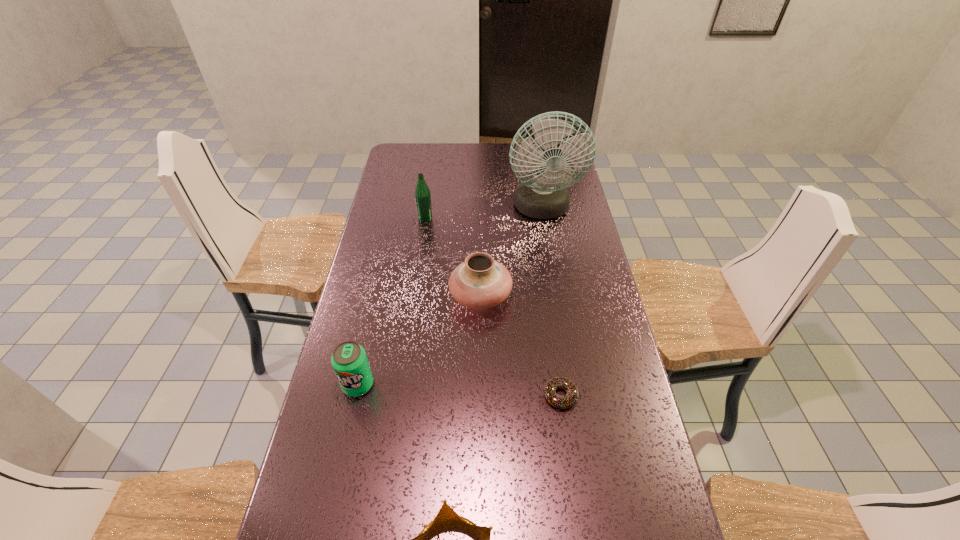
In order to click on free space between the fan and the second object from left to right in this screenshot , I will do [x=484, y=214].

Locate an element on the screen. Image resolution: width=960 pixels, height=540 pixels. free space between the shortest object and the leftmost object is located at coordinates (459, 390).

Locate an element on the screen. vacant space that is in between the third farthest object and the shortest object is located at coordinates (520, 346).

Select which object appears as the second closest to the fan. Please provide its 2D coordinates. Your answer should be formatted as a tuple, i.e. [(x, y)], where the tuple contains the x and y coordinates of a point satisfying the conditions above.

[(422, 193)]

Identify the location of object that is the second closest to the pottery. This screenshot has height=540, width=960. (570, 399).